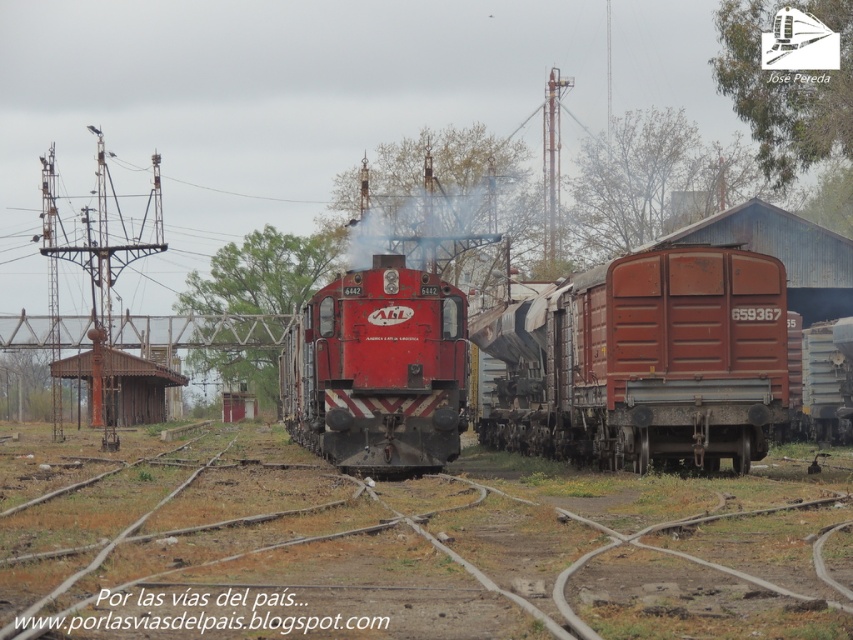
You are a train engineer who needs to ensure the shiny red locomotive at center is properly aligned on the brown dirt train track at center. Based on the scene, is the locomotive correctly positioned on the track?

The brown dirt train track at center is positioned under the shiny red locomotive at center, meaning the locomotive is correctly aligned on the track.

You are a railway inspector checking the train composition. You notice the rusty metal train car at right and the shiny red locomotive at center. According to the standard operating procedure, the locomotive must be positioned in front of all freight cars. Is the current arrangement compliant with the rules?

The rusty metal train car at right is in front of the shiny red locomotive at center, which violates the standard operating procedure requiring the locomotive to be positioned in front of all freight cars.